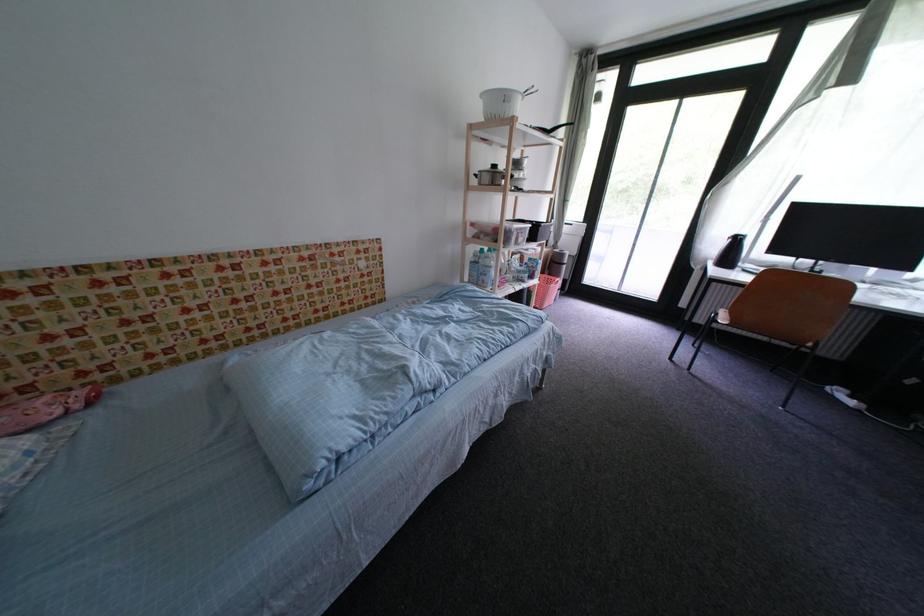
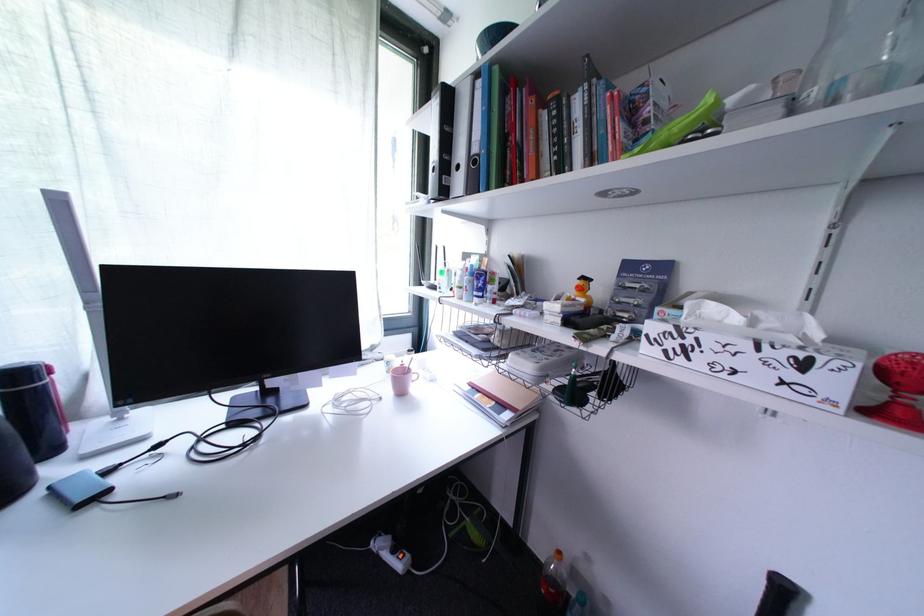
Locate, in the second image, the point that corresponds to [858,399] in the first image.

(402, 553)